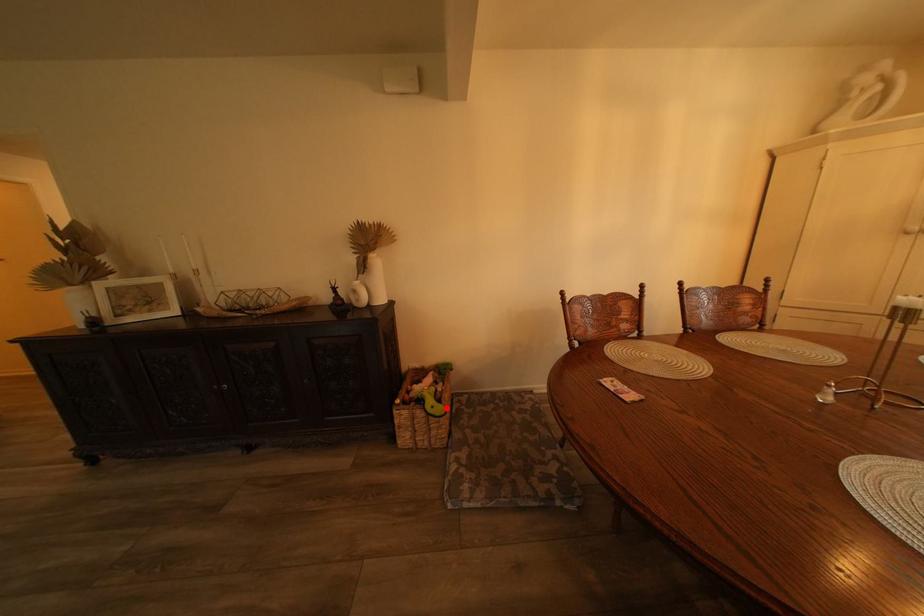
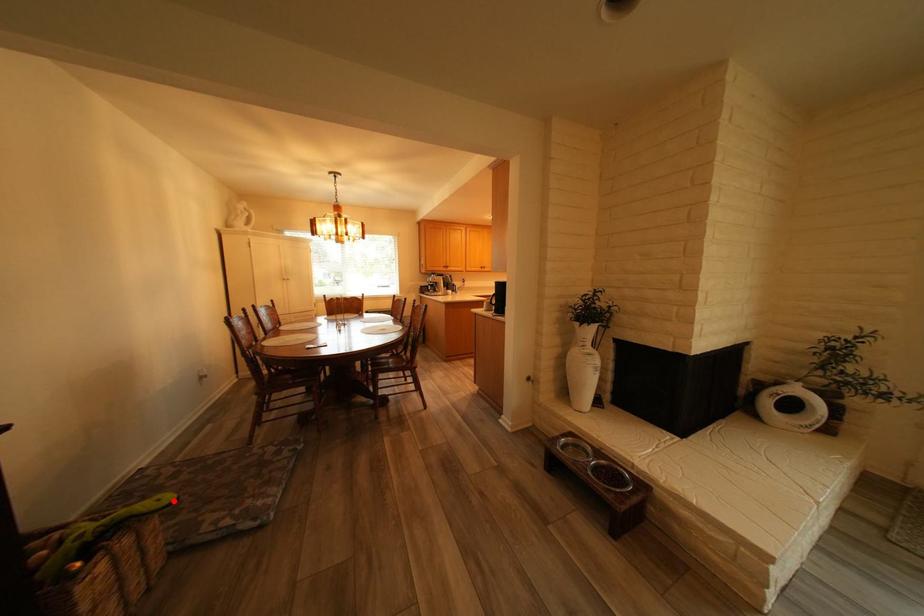
I am providing you with two images of the same scene from different viewpoints. A red point is marked on the first image and another point is marked on the second image. Do the highlighted points in image1 and image2 indicate the same real-world spot?

Yes